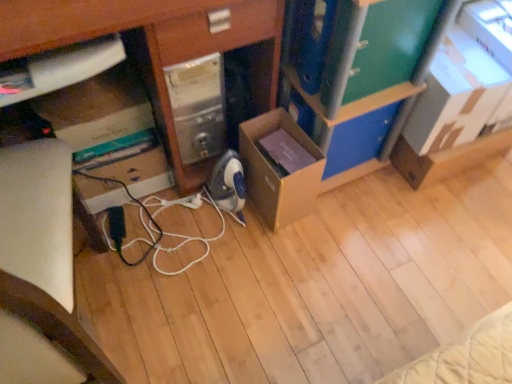
You are a GUI agent. You are given a task and a screenshot of the screen. Output one action in this format:
    pyautogui.click(x=<x>, y=<y>)
    Task: Click on the free space in front of brown cardboard box at center, positioned as the second cardboard box in right-to-left order
    The width and height of the screenshot is (512, 384).
    Given the screenshot: What is the action you would take?
    pyautogui.click(x=284, y=249)